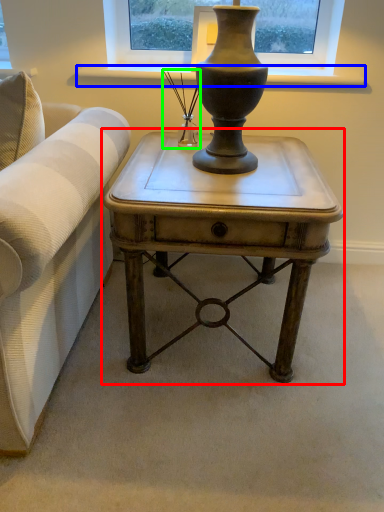
Question: Estimate the real-world distances between objects in this image. Which object is closer to table (highlighted by a red box), window sill (highlighted by a blue box) or candle holder (highlighted by a green box)?

Choices:
 (A) window sill
 (B) candle holder

Answer: (B)